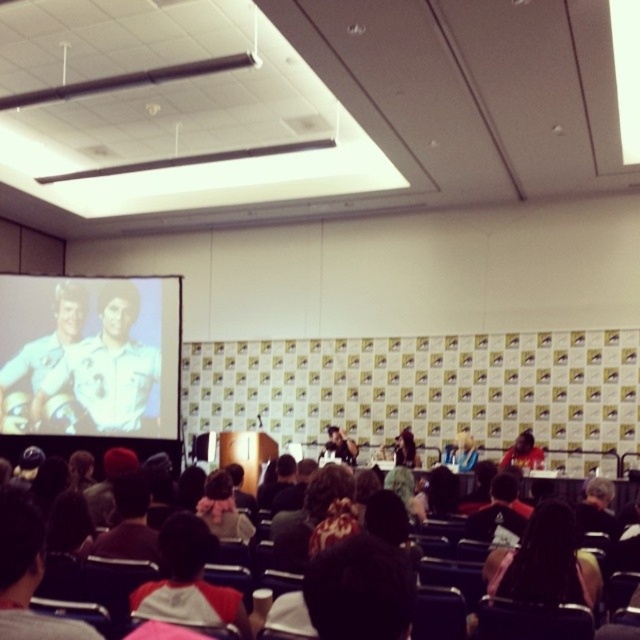
You are sitting in the front row of the conference room and want to see the matte white screen at upper left clearly. The screen is 9.27 meters away from you. If your optimal viewing distance for such screens is 8 meters, will you be able to see the screen clearly from your current position?

The matte white screen at upper left is 9.27 meters away from the viewer, which is beyond the optimal viewing distance of 8 meters. Therefore, you may not be able to see the screen clearly from your current position.

You are organizing a small event and need to place a 2.5 meter long banner between the matte white screen at upper left and the white cotton shirt at center. Is there enough space between them to fit the banner without bending it?

The distance between the matte white screen at upper left and the white cotton shirt at center is 7.18 meters, which is more than enough to fit a 2.5 meter long banner without bending it.

You are organizing a presentation and need to decide where to place a new projector. The projector can only project onto the matte white screen at upper left or the white cotton shirt at center. Which object is larger and thus better suited for projection?

The matte white screen at upper left is bigger than the white cotton shirt at center, making it the better choice for projection.